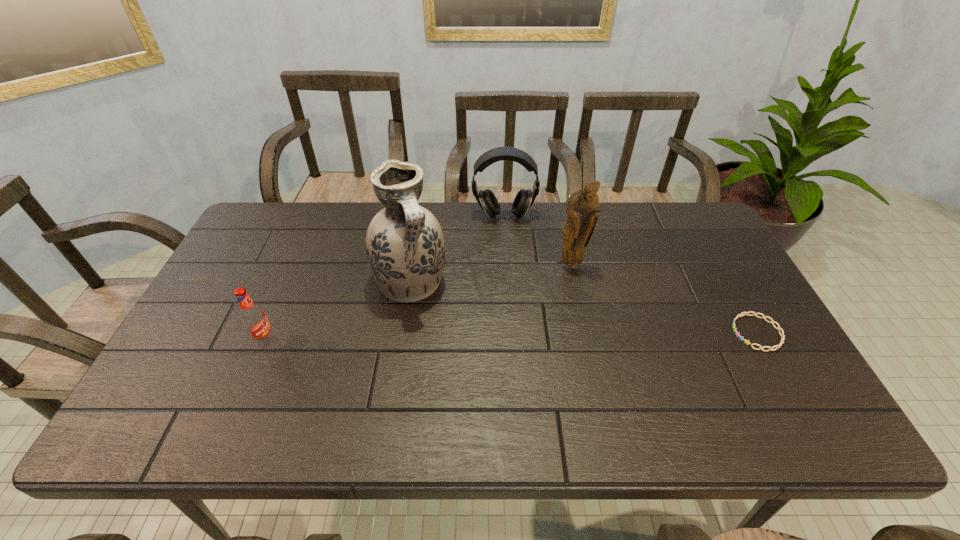
Where is `blank space located on the right of the leftmost object`? Image resolution: width=960 pixels, height=540 pixels. blank space located on the right of the leftmost object is located at coordinates (370, 340).

Locate an element on the screen. free spot located on the surface of the shortest object showing star-shaped elements is located at coordinates (614, 333).

You are a GUI agent. You are given a task and a screenshot of the screen. Output one action in this format:
    pyautogui.click(x=<x>, y=<y>)
    Task: Click on the vacant space located on the surface of the shortest object showing star-shaped elements
    The image size is (960, 540).
    Given the screenshot: What is the action you would take?
    pyautogui.click(x=603, y=333)

This screenshot has width=960, height=540. Find the location of `vacant point located 0.090m on the surface of the shortest object showing star-shaped elements`. vacant point located 0.090m on the surface of the shortest object showing star-shaped elements is located at coordinates (699, 333).

The width and height of the screenshot is (960, 540). I want to click on free region located with the handle on the side of the tallest object, so click(451, 347).

In order to click on blank space located with the handle on the side of the tallest object in this screenshot , I will do `click(470, 376)`.

The height and width of the screenshot is (540, 960). I want to click on free location located with the handle on the side of the tallest object, so click(455, 353).

At what (x,y) coordinates should I click in order to perform the action: click on free spot located 0.310m on the ear cups of the farthest object. Please return your answer as a coordinate pair (x, y). The image size is (960, 540). Looking at the image, I should click on (508, 293).

You are a GUI agent. You are given a task and a screenshot of the screen. Output one action in this format:
    pyautogui.click(x=<x>, y=<y>)
    Task: Click on the vacant space situated 0.290m on the ear cups of the farthest object
    The height and width of the screenshot is (540, 960).
    Given the screenshot: What is the action you would take?
    pyautogui.click(x=508, y=288)

Locate an element on the screen. free space located on the ear cups of the farthest object is located at coordinates (508, 291).